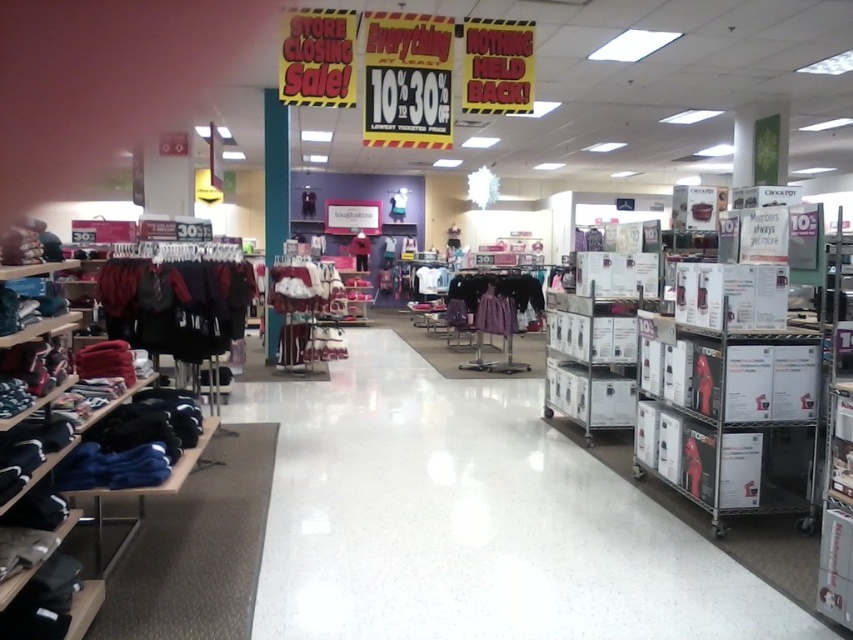
Who is positioned more to the left, dark red fabric shirt at left or velvet maroon dress at center?

dark red fabric shirt at left is more to the left.

Does point (227, 323) come behind point (293, 269)?

No, (227, 323) is closer to viewer.

Between point (109, 280) and point (329, 305), which one is positioned in front?

Point (109, 280) is in front.

I want to click on dark red fabric shirt at left, so click(x=175, y=305).

Who is more forward, (x=77, y=476) or (x=447, y=321)?

Point (x=77, y=476) is in front.

What do you see at coordinates (132, 442) in the screenshot?
I see `dark blue fabric pants at left` at bounding box center [132, 442].

This screenshot has height=640, width=853. I want to click on dark blue fabric pants at left, so pos(132,442).

Between dark blue fabric pants at left and velvet maroon dress at center, which one is positioned higher?

velvet maroon dress at center

Which of these two, dark blue fabric pants at left or velvet maroon dress at center, stands shorter?

dark blue fabric pants at left is shorter.

What do you see at coordinates (132, 442) in the screenshot? This screenshot has width=853, height=640. I see `dark blue fabric pants at left` at bounding box center [132, 442].

I want to click on dark blue fabric pants at left, so click(132, 442).